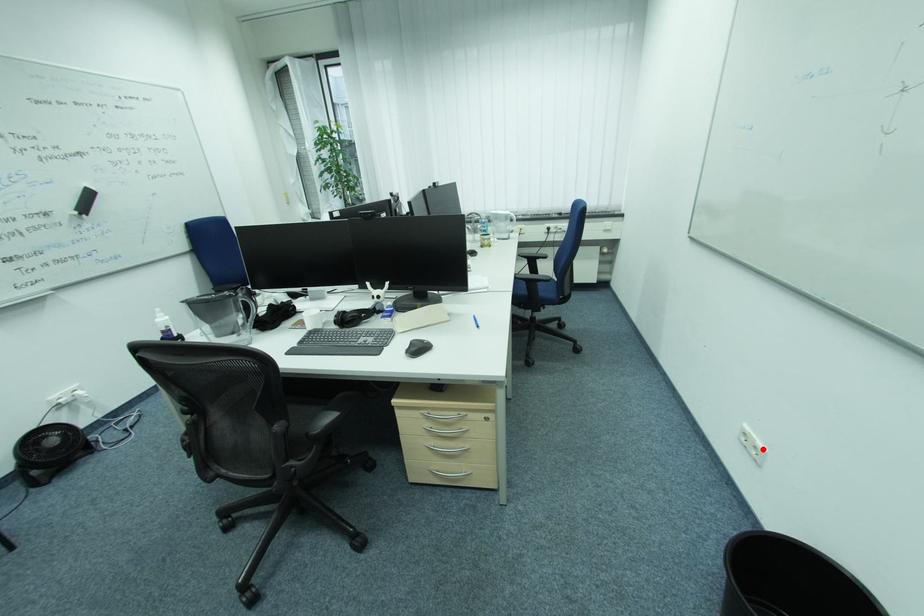
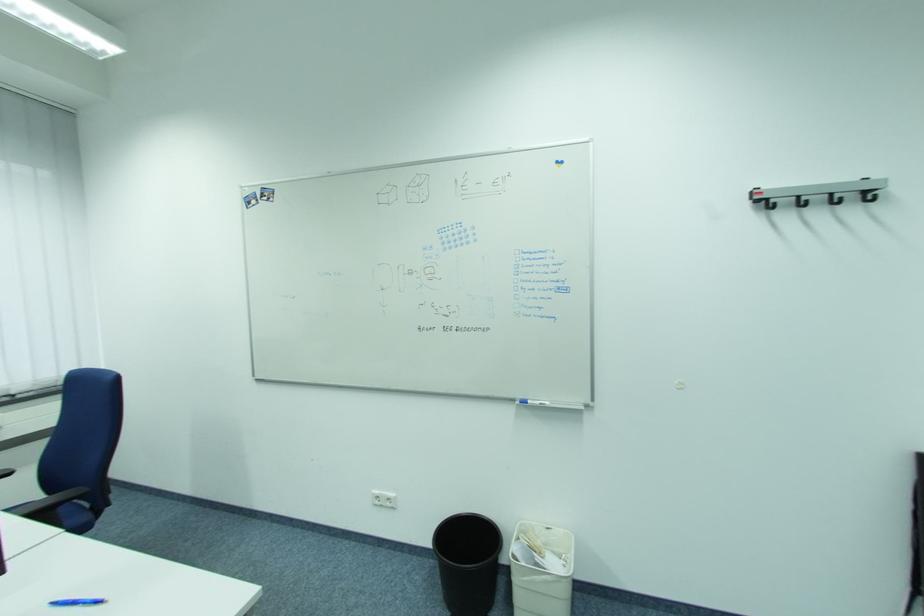
Locate, in the second image, the point that corresponds to the highlighted location in the first image.

(395, 500)